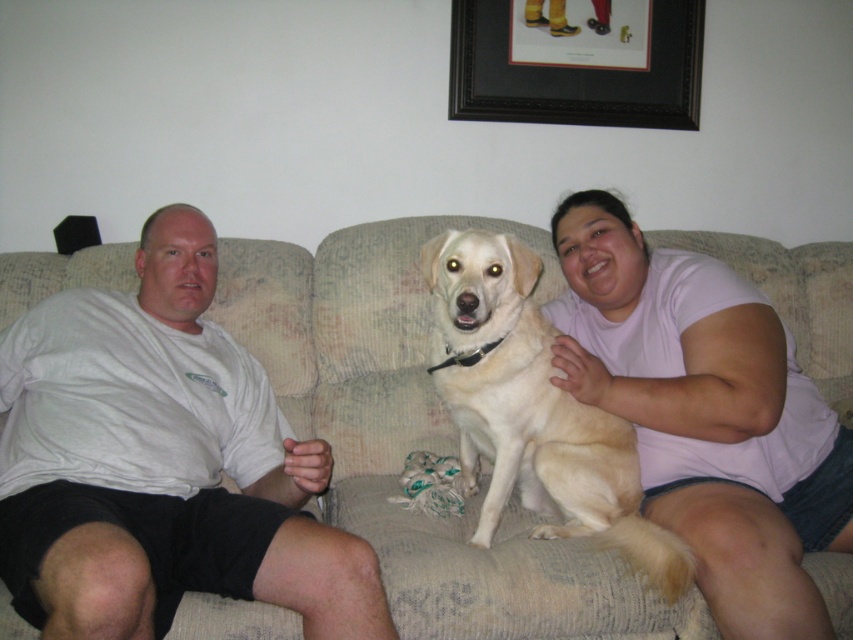
Does white cotton shirt at left have a greater height compared to black wood picture frame at upper center?

Yes, white cotton shirt at left is taller than black wood picture frame at upper center.

Measure the distance from white cotton shirt at left to black wood picture frame at upper center.

white cotton shirt at left is 1.26 meters from black wood picture frame at upper center.

Between point (146, 262) and point (488, 115), which one is positioned in front?

Positioned in front is point (146, 262).

Where is `white cotton shirt at left`? This screenshot has width=853, height=640. white cotton shirt at left is located at coordinates (161, 464).

Can you confirm if beige fabric couch at center is thinner than black wood picture frame at upper center?

No.

Is beige fabric couch at center positioned before black wood picture frame at upper center?

That is True.

Is point (256, 634) less distant than point (563, 4)?

Yes, point (256, 634) is closer to viewer.

The height and width of the screenshot is (640, 853). I want to click on beige fabric couch at center, so pos(415,436).

Is white cotton shirt at left above matte pink shirt at center?

Actually, white cotton shirt at left is below matte pink shirt at center.

Does white cotton shirt at left appear on the left side of matte pink shirt at center?

Correct, you'll find white cotton shirt at left to the left of matte pink shirt at center.

At what (x,y) coordinates should I click in order to perform the action: click on white cotton shirt at left. Please return your answer as a coordinate pair (x, y). Looking at the image, I should click on (161, 464).